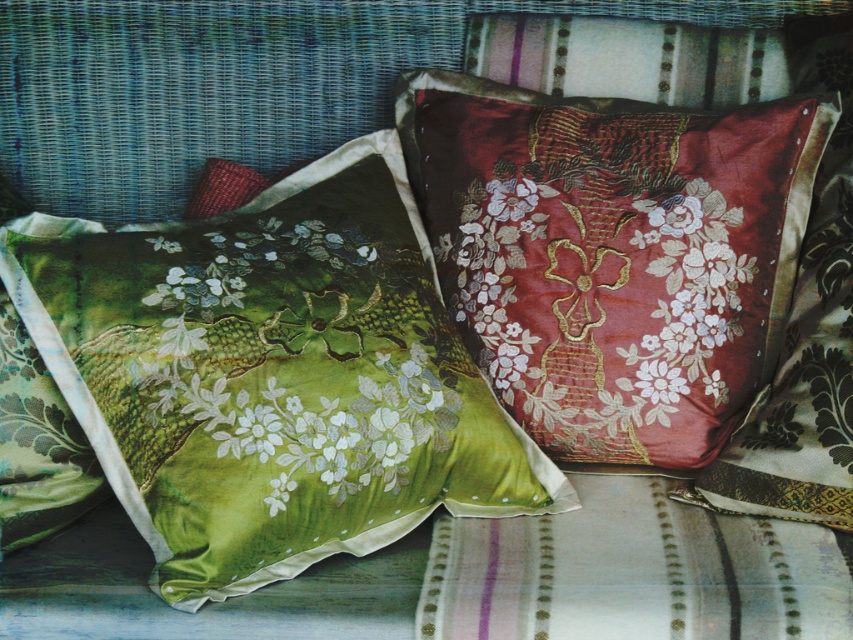
Is velvet floral cushion at center positioned in front of silky red floral cushion at center?

No, velvet floral cushion at center is behind silky red floral cushion at center.

Is velvet floral cushion at center shorter than silky red floral cushion at center?

No.

Between point (537, 234) and point (491, 346), which one is positioned behind?

Positioned behind is point (491, 346).

Where is `velvet floral cushion at center`? The width and height of the screenshot is (853, 640). velvet floral cushion at center is located at coordinates (613, 256).